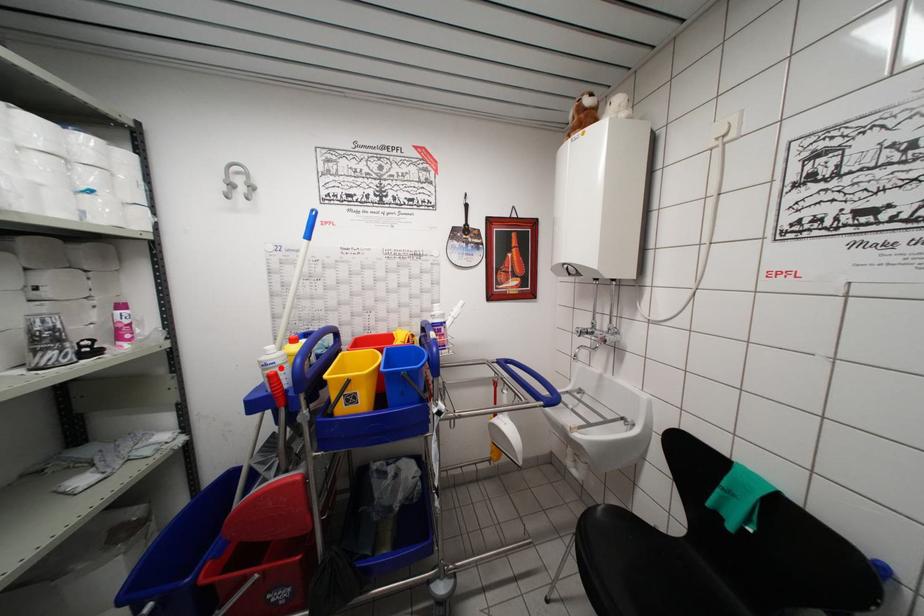
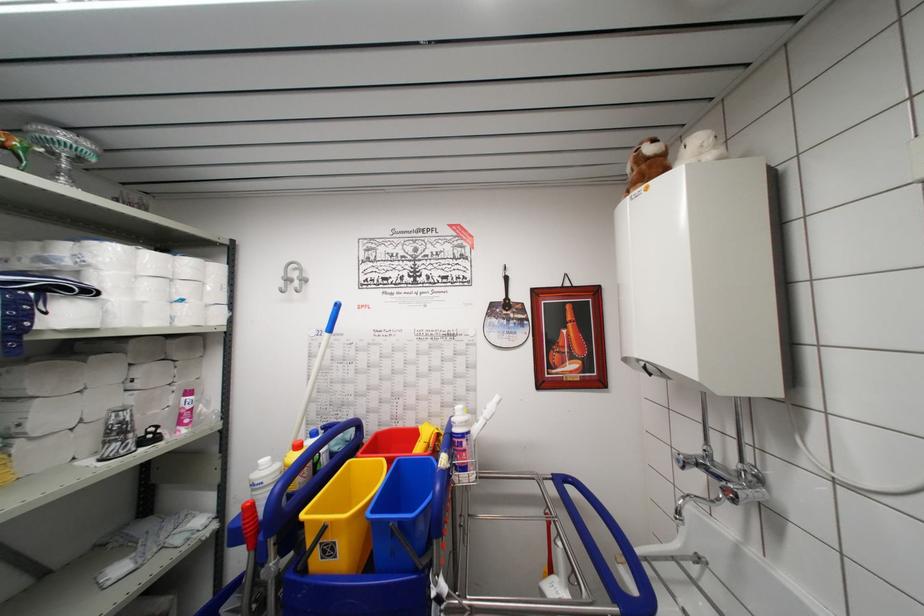
The point at the highlighted location is marked in the first image. Where is the corresponding point in the second image?

(269, 488)